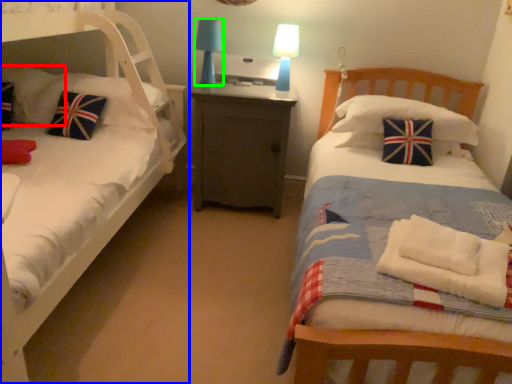
Question: Which is nearer to the pillow (highlighted by a red box)? bed (highlighted by a blue box) or table lamp (highlighted by a green box).

Choices:
 (A) bed
 (B) table lamp

Answer: (A)